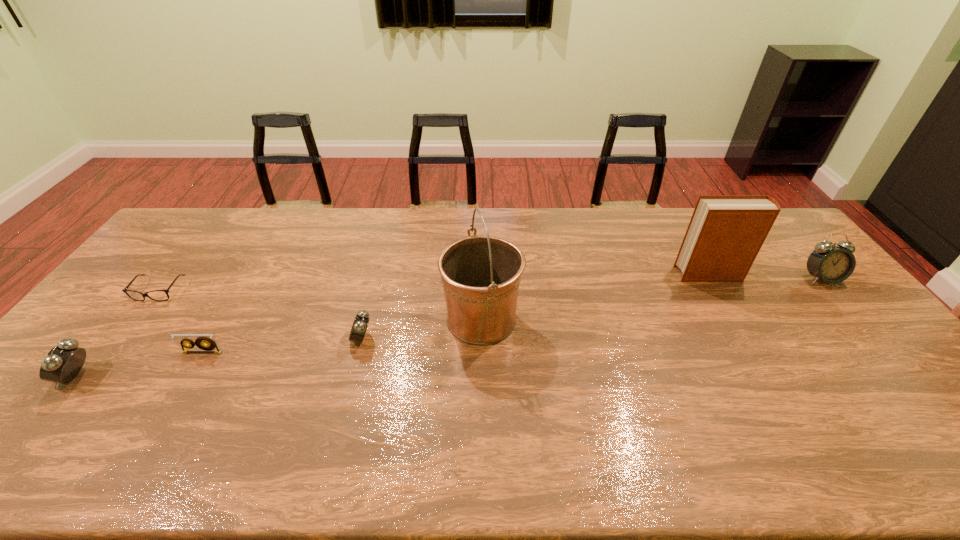
The image size is (960, 540). I want to click on free space at the far left corner, so click(204, 216).

The width and height of the screenshot is (960, 540). I want to click on free spot between the second nearest alarm clock and the shortest object, so click(x=260, y=315).

The height and width of the screenshot is (540, 960). I want to click on free area in between the shortest alarm clock and the tallest object, so click(421, 329).

This screenshot has height=540, width=960. In order to click on free spot between the second farthest alarm clock and the fifth object from left to right in this screenshot , I will do `click(421, 329)`.

At what (x,y) coordinates should I click in order to perform the action: click on vacant region between the rightmost alarm clock and the hardback book. Please return your answer as a coordinate pair (x, y). Looking at the image, I should click on (765, 276).

This screenshot has height=540, width=960. What are the coordinates of `free point between the fourth object from left to right and the hardback book` in the screenshot? It's located at (536, 306).

Locate an element on the screen. Image resolution: width=960 pixels, height=540 pixels. vacant area between the leftmost alarm clock and the shortest object is located at coordinates (117, 334).

Find the location of a particular element. vacant area between the fourth object from right to left and the third object from left to right is located at coordinates (282, 346).

Identify the location of unoccupied area between the videotape and the fifth object from left to right. (342, 336).

Locate an element on the screen. free area in between the fifth object from right to left and the second shortest alarm clock is located at coordinates (139, 364).